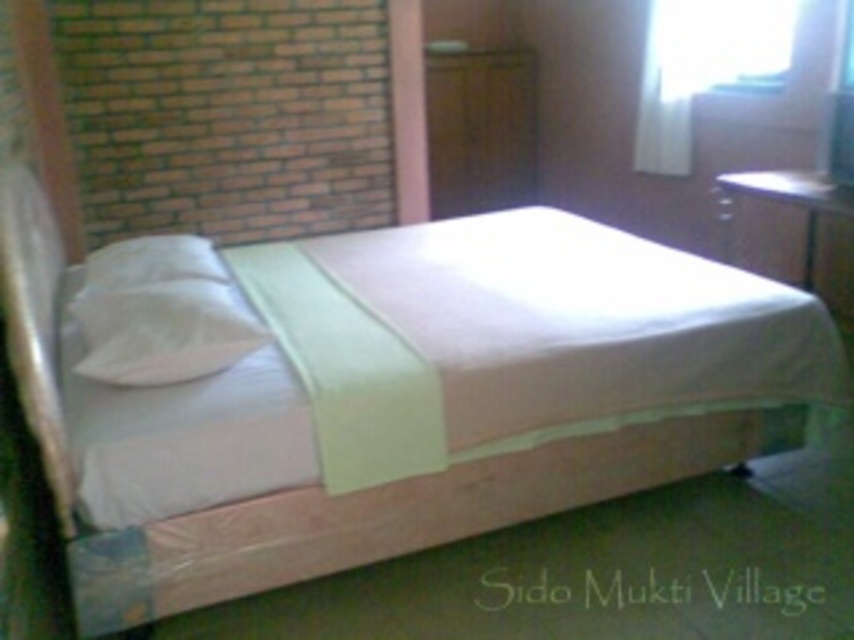
Can you confirm if transparent glass window at upper right is positioned below white soft pillow at left?

No, transparent glass window at upper right is not below white soft pillow at left.

Which is behind, point (679, 154) or point (156, 374)?

The point (679, 154) is behind.

Does point (681, 48) lie behind point (200, 289)?

Yes, it is behind point (200, 289).

Locate an element on the screen. This screenshot has width=854, height=640. transparent glass window at upper right is located at coordinates pos(703,67).

Between point (490, 131) and point (161, 304), which one is positioned in front?

Point (161, 304) is more forward.

Is wooden dresser at center smaller than white soft pillow at left?

No.

Describe the element at coordinates (480, 129) in the screenshot. I see `wooden dresser at center` at that location.

The image size is (854, 640). Find the location of `wooden dresser at center`. wooden dresser at center is located at coordinates (480, 129).

Which of these two, wooden dresser at center or matte wood dresser at upper right, stands shorter?

With less height is matte wood dresser at upper right.

Between point (458, 109) and point (806, 268), which one is positioned behind?

Point (458, 109)

The width and height of the screenshot is (854, 640). Identify the location of wooden dresser at center. (480, 129).